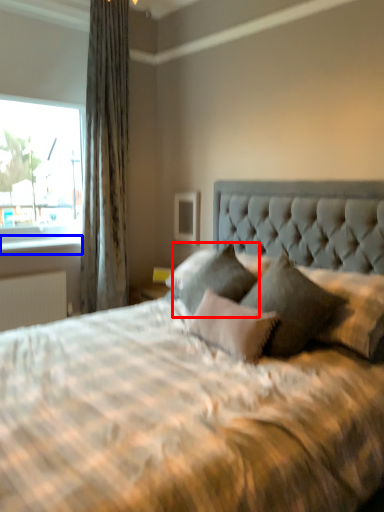
Question: Among these objects, which one is nearest to the camera, pillow (highlighted by a red box) or window sill (highlighted by a blue box)?

Choices:
 (A) pillow
 (B) window sill

Answer: (A)